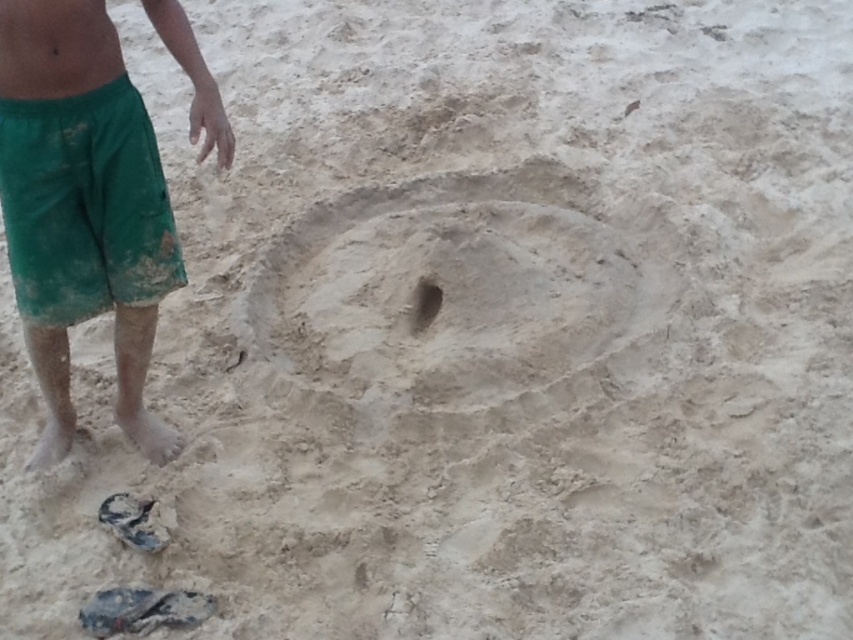
Question: Which object is the farthest from the green cotton shorts at lower left?

Choices:
 (A) green cotton shorts at left
 (B) skinny bare torso at upper left
 (C) smooth sand hole at center

Answer: (C)

Question: Does green cotton shorts at left appear on the right side of smooth sand hole at center?

Choices:
 (A) no
 (B) yes

Answer: (A)

Question: Which of the following is the farthest from the observer?

Choices:
 (A) (194, 74)
 (B) (28, 240)
 (C) (424, 282)

Answer: (C)

Question: Which object appears farthest from the camera in this image?

Choices:
 (A) skinny bare torso at upper left
 (B) green cotton shorts at left

Answer: (B)

Question: Is skinny bare torso at upper left above smooth sand hole at center?

Choices:
 (A) yes
 (B) no

Answer: (A)

Question: Does skinny bare torso at upper left appear on the left side of smooth sand hole at center?

Choices:
 (A) yes
 (B) no

Answer: (A)